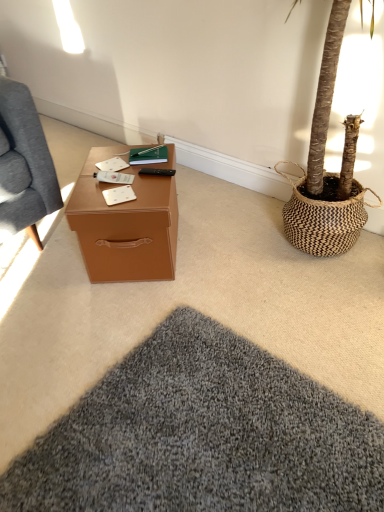
This screenshot has width=384, height=512. Identify the location of vacant space to the right of white matte notepad at center. (147, 193).